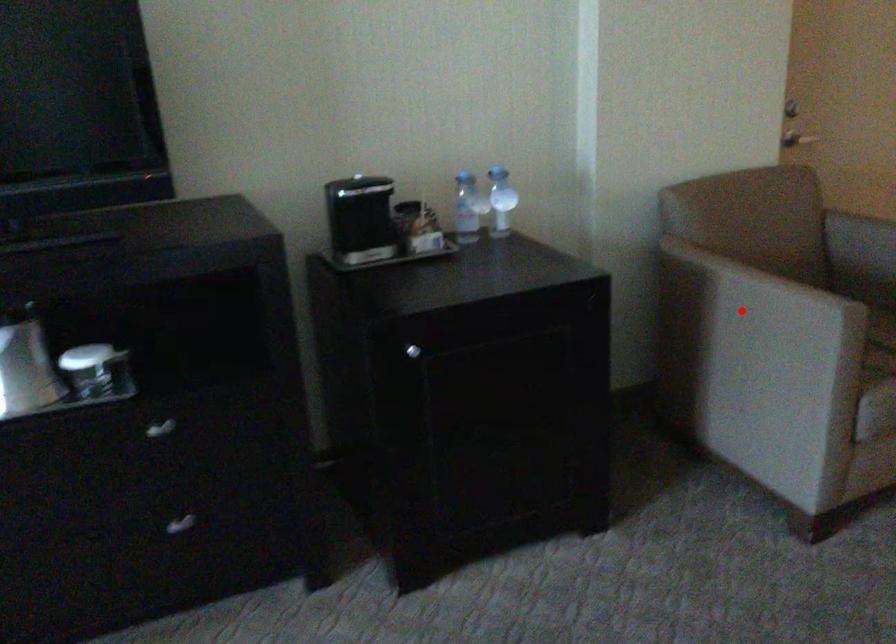
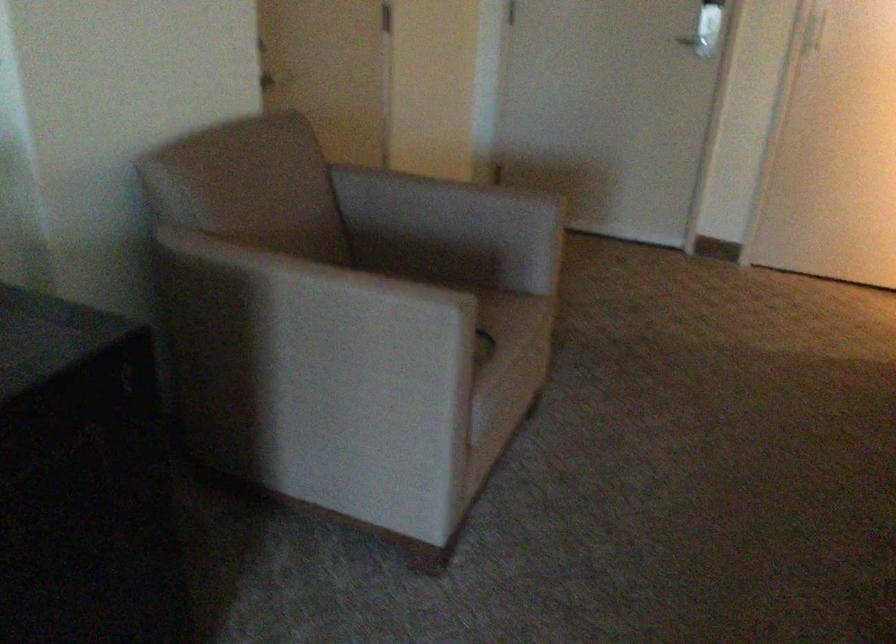
Find the pixel in the second image that matches the highlighted location in the first image.

(314, 325)